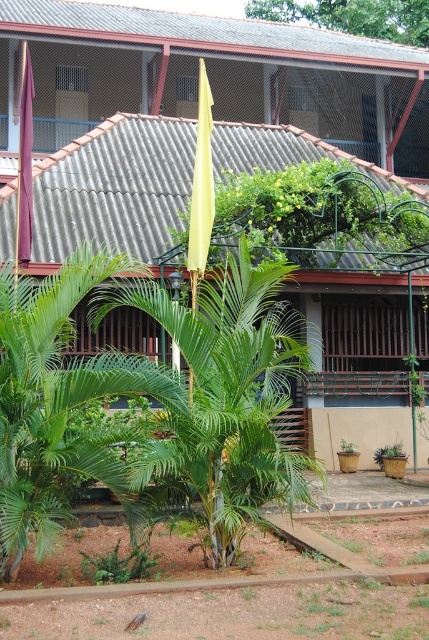
Between point (283, 369) and point (384, 445), which one is positioned behind?

The point (384, 445) is more distant.

Between green leafy palm at center and green matte planter at lower center, which one appears on the right side from the viewer's perspective?

Positioned to the right is green matte planter at lower center.

Where is `green leafy palm at center`? green leafy palm at center is located at coordinates point(226,396).

Does green leafy palm at center appear on the right side of green leafy palm tree at center?

Indeed, green leafy palm at center is positioned on the right side of green leafy palm tree at center.

Is point (213, 410) closer to camera compared to point (123, 273)?

Yes, it is in front of point (123, 273).

The image size is (429, 640). What do you see at coordinates (226, 396) in the screenshot?
I see `green leafy palm at center` at bounding box center [226, 396].

Locate an element on the screen. The height and width of the screenshot is (640, 429). green leafy palm at center is located at coordinates (226, 396).

Can you confirm if green leafy palm tree at center is positioned to the left of green matte planter at lower center?

Indeed, green leafy palm tree at center is positioned on the left side of green matte planter at lower center.

Which is above, green leafy palm tree at center or green matte planter at lower center?

green leafy palm tree at center

Between point (51, 467) and point (384, 449), which one is positioned in front?

Point (51, 467) is more forward.

This screenshot has width=429, height=640. Find the location of `green leafy palm tree at center`. green leafy palm tree at center is located at coordinates (59, 401).